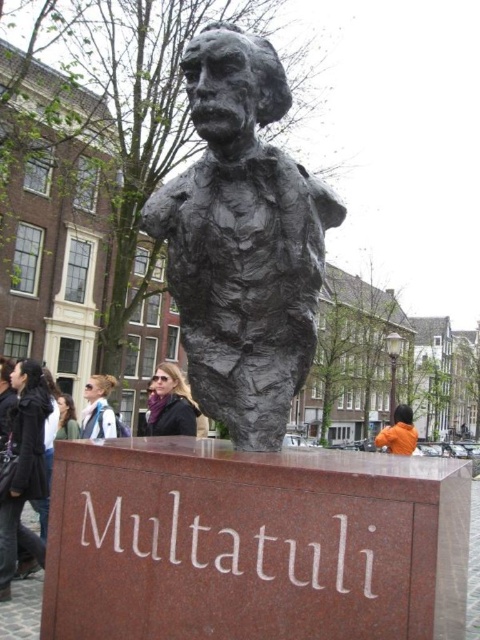
Question: Is black bronze bust at center positioned in front of light brown hair at center?

Choices:
 (A) yes
 (B) no

Answer: (A)

Question: Among these points, which one is nearest to the camera?

Choices:
 (A) (272, 420)
 (B) (398, 422)
 (C) (87, 426)

Answer: (A)

Question: Is black bronze bust at center further to camera compared to matte black jacket at center?

Choices:
 (A) no
 (B) yes

Answer: (A)

Question: Which point appears closest to the camera in this image?

Choices:
 (A) (160, 368)
 (B) (99, 397)
 (C) (398, 417)

Answer: (A)

Question: Which of the following is the farthest from the observer?

Choices:
 (A) matte black jacket at center
 (B) light brown hair at center
 (C) orange fabric jacket at lower right

Answer: (C)

Question: Does black bronze bust at center come in front of light brown hair at center?

Choices:
 (A) no
 (B) yes

Answer: (B)